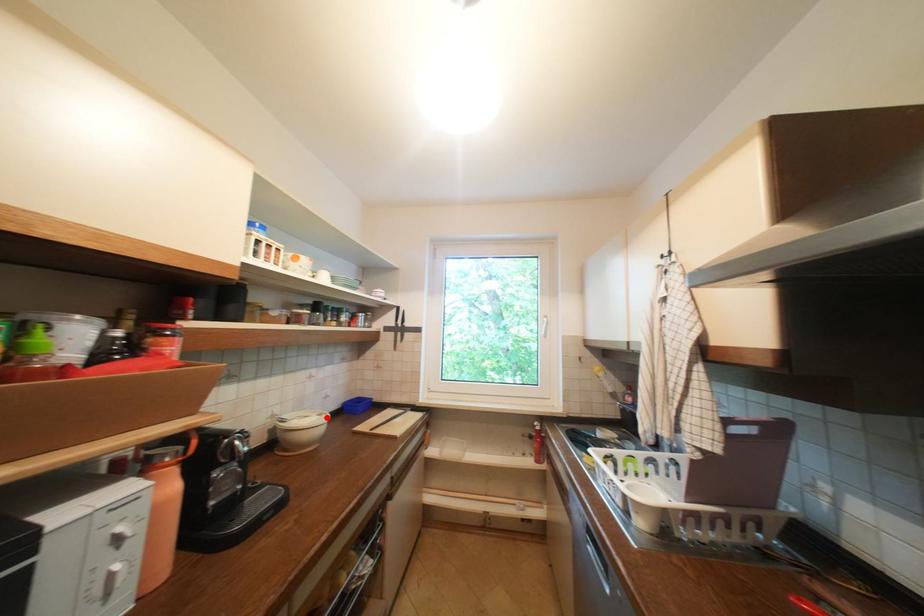
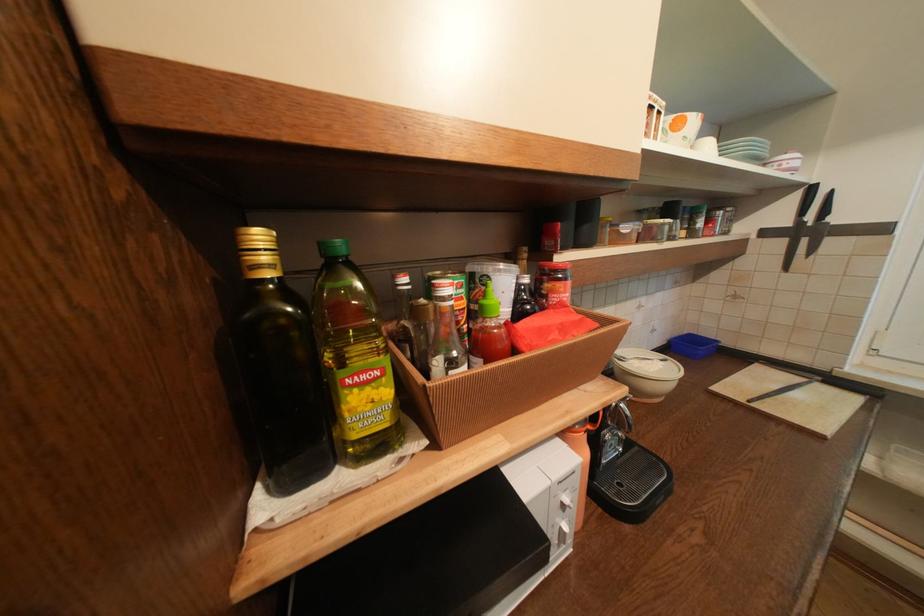
Where in the second image is the point corresponding to the highlighted location from the first image?

(670, 363)